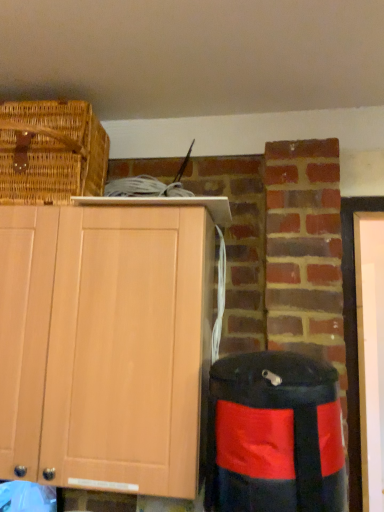
Question: Is light wood cabinet at upper left with woven brown picnic basket at upper left?

Choices:
 (A) no
 (B) yes

Answer: (A)

Question: Are light wood cabinet at upper left and woven brown picnic basket at upper left far apart?

Choices:
 (A) yes
 (B) no

Answer: (B)

Question: Is light wood cabinet at upper left surrounding woven brown picnic basket at upper left?

Choices:
 (A) no
 (B) yes

Answer: (A)

Question: Considering the relative sizes of light wood cabinet at upper left and woven brown picnic basket at upper left in the image provided, is light wood cabinet at upper left shorter than woven brown picnic basket at upper left?

Choices:
 (A) yes
 (B) no

Answer: (B)

Question: Is light wood cabinet at upper left facing away from woven brown picnic basket at upper left?

Choices:
 (A) no
 (B) yes

Answer: (A)

Question: Is light wood cabinet at upper left taller than woven brown picnic basket at upper left?

Choices:
 (A) no
 (B) yes

Answer: (B)

Question: Is black fabric trash bin/can at lower right placed right next to light wood cabinet at upper left?

Choices:
 (A) yes
 (B) no

Answer: (B)

Question: Is black fabric trash bin/can at lower right thinner than light wood cabinet at upper left?

Choices:
 (A) yes
 (B) no

Answer: (A)

Question: Does black fabric trash bin/can at lower right have a smaller size compared to light wood cabinet at upper left?

Choices:
 (A) no
 (B) yes

Answer: (B)

Question: From the image's perspective, is black fabric trash bin/can at lower right on top of light wood cabinet at upper left?

Choices:
 (A) yes
 (B) no

Answer: (B)

Question: Is black fabric trash bin/can at lower right facing away from light wood cabinet at upper left?

Choices:
 (A) no
 (B) yes

Answer: (A)

Question: Does black fabric trash bin/can at lower right appear on the left side of light wood cabinet at upper left?

Choices:
 (A) yes
 (B) no

Answer: (B)

Question: Considering the relative positions of light wood cabinet at upper left and black fabric trash bin/can at lower right in the image provided, is light wood cabinet at upper left to the right of black fabric trash bin/can at lower right from the viewer's perspective?

Choices:
 (A) no
 (B) yes

Answer: (A)